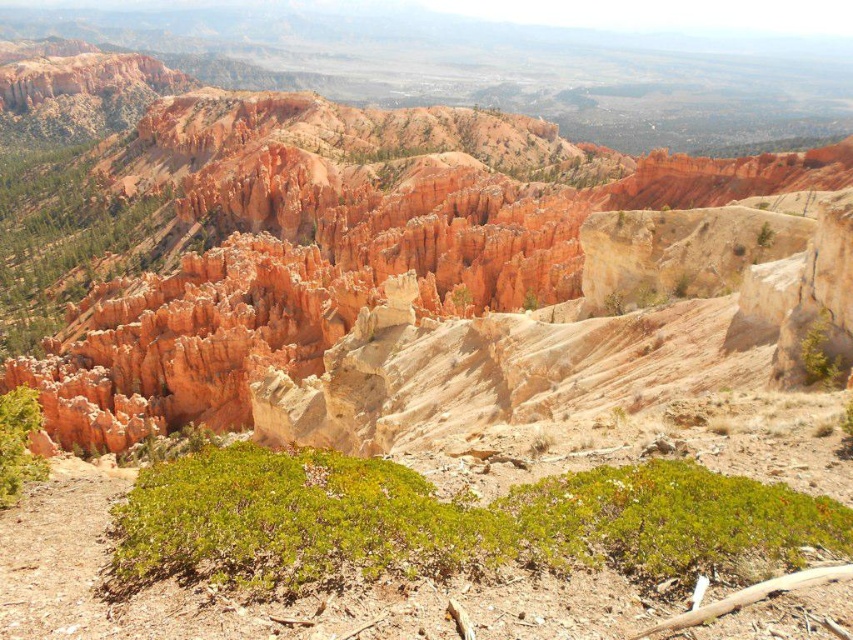
You are a hiker who wants to take a photo of the green shrubbery at center and the green shrubbery at left. Which shrubbery should you stand closer to in order to capture both in the same frame?

You should stand closer to the green shrubbery at center because it is shorter than the green shrubbery at left, allowing both to be captured in the same frame when positioned appropriately.

You are a hiker navigating through the desert and see the green shrubbery at center and the green leafy bush at lower left. Which one is closer to you?

The green shrubbery at center is closer to you as it is positioned in front of the green leafy bush at lower left.